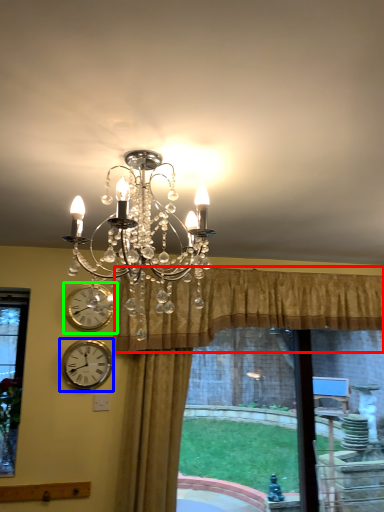
Question: Which is farther away from curtain (highlighted by a red box)? wall clock (highlighted by a blue box) or wall clock (highlighted by a green box)?

Choices:
 (A) wall clock
 (B) wall clock

Answer: (B)